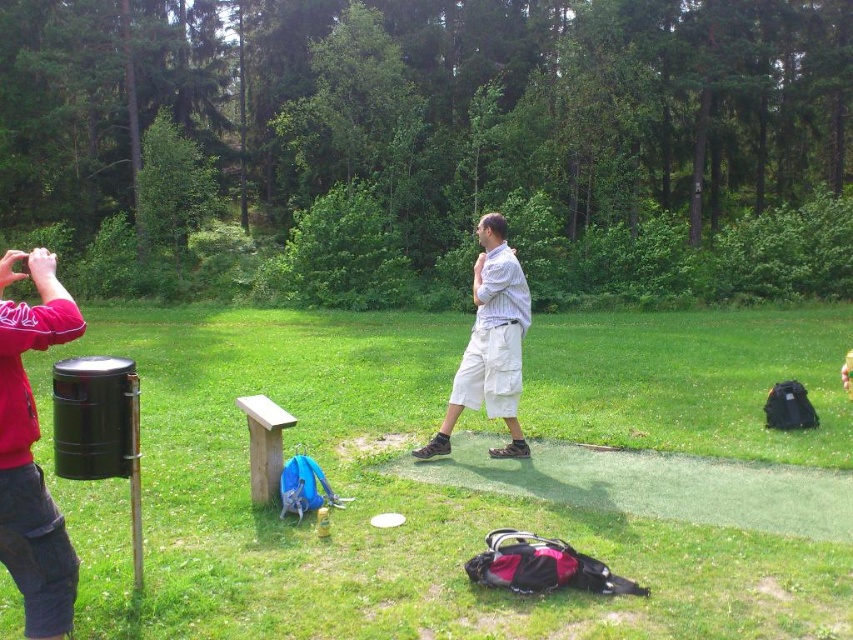
You are a photographer trying to capture both the matte red shirt at left and the white cotton shirt at center in a single frame. Based on their heights, which one might appear larger in the photo?

The white cotton shirt at center appears taller than the matte red shirt at left, so it would likely look larger in the photo.

You are standing at the point with coordinates point [20,525] and want to walk towards the point with coordinates point [477,403]. Based on the scene description, will you have to walk through any obstacles or people along the way?

Point [20,525] is in front of point [477,403], so you will have to walk backwards to reach the destination point, which might be challenging due to the dense greenery and people in the scene.